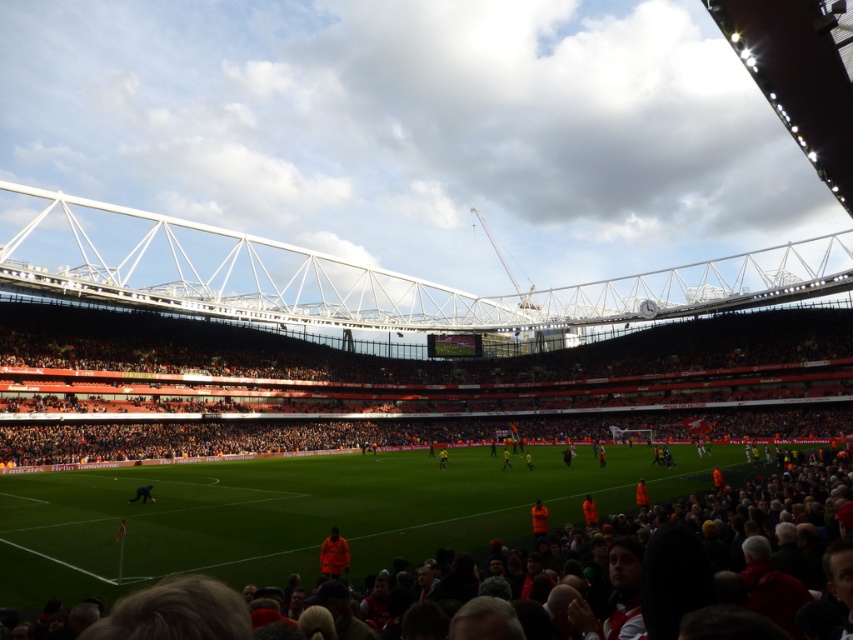
Can you confirm if dark blue fabric at center is positioned below yellow jersey at center?

No, dark blue fabric at center is not below yellow jersey at center.

Between dark blue fabric at center and yellow jersey at center, which one has less height?

dark blue fabric at center is shorter.

Which is behind, point (137, 497) or point (438, 454)?

The point (438, 454) is more distant.

This screenshot has width=853, height=640. I want to click on dark blue fabric at center, so click(142, 493).

Is dark blue fabric at center thinner than yellow uniform at center?

No.

Can you confirm if dark blue fabric at center is shorter than yellow uniform at center?

Yes, dark blue fabric at center is shorter than yellow uniform at center.

The image size is (853, 640). I want to click on dark blue fabric at center, so click(142, 493).

Does orange fabric jacket at lower center appear on the left side of yellow uniform at center?

Correct, you'll find orange fabric jacket at lower center to the left of yellow uniform at center.

Which is above, orange fabric jacket at lower center or yellow uniform at center?

orange fabric jacket at lower center is higher up.

Looking at this image, who is more forward, (534, 524) or (503, 467)?

Point (534, 524) is in front.

Where is `orange fabric jacket at lower center`? orange fabric jacket at lower center is located at coordinates (538, 518).